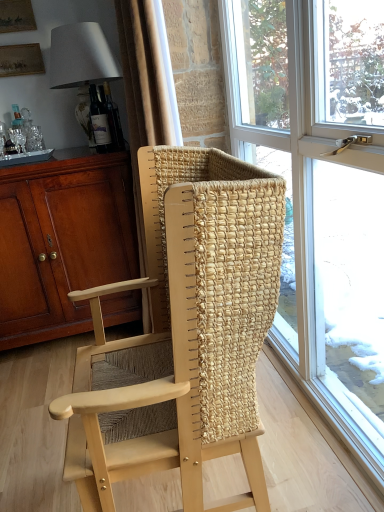
Question: From a real-world perspective, is matte gray lampshade at upper left under matte brown cabinet at left?

Choices:
 (A) yes
 (B) no

Answer: (B)

Question: Does matte gray lampshade at upper left have a smaller size compared to matte brown cabinet at left?

Choices:
 (A) no
 (B) yes

Answer: (B)

Question: Is matte gray lampshade at upper left further to the viewer compared to matte brown cabinet at left?

Choices:
 (A) no
 (B) yes

Answer: (B)

Question: Can you confirm if matte gray lampshade at upper left is taller than matte brown cabinet at left?

Choices:
 (A) no
 (B) yes

Answer: (A)

Question: Is the surface of matte gray lampshade at upper left in direct contact with matte brown cabinet at left?

Choices:
 (A) yes
 (B) no

Answer: (B)

Question: From a real-world perspective, relative to beige fabric curtain at upper center, is matte brown cabinet at left vertically above or below?

Choices:
 (A) above
 (B) below

Answer: (B)

Question: Considering their positions, is matte brown cabinet at left located in front of or behind beige fabric curtain at upper center?

Choices:
 (A) behind
 (B) front

Answer: (A)

Question: Is matte brown cabinet at left situated inside beige fabric curtain at upper center or outside?

Choices:
 (A) inside
 (B) outside

Answer: (B)

Question: Considering the positions of matte brown cabinet at left and beige fabric curtain at upper center in the image, is matte brown cabinet at left bigger or smaller than beige fabric curtain at upper center?

Choices:
 (A) big
 (B) small

Answer: (A)

Question: In terms of height, does matte gray lampshade at upper left look taller or shorter compared to matte brown cabinet at left?

Choices:
 (A) short
 (B) tall

Answer: (A)

Question: Is matte gray lampshade at upper left spatially inside matte brown cabinet at left, or outside of it?

Choices:
 (A) inside
 (B) outside

Answer: (B)

Question: Based on their positions, is matte gray lampshade at upper left located to the left or right of matte brown cabinet at left?

Choices:
 (A) right
 (B) left

Answer: (A)

Question: From the image's perspective, relative to matte brown cabinet at left, is matte gray lampshade at upper left above or below?

Choices:
 (A) above
 (B) below

Answer: (A)

Question: Is natural woven wood chair at center to the left or to the right of matte brown cabinet at left in the image?

Choices:
 (A) left
 (B) right

Answer: (B)

Question: Looking at the image, does natural woven wood chair at center seem bigger or smaller compared to matte brown cabinet at left?

Choices:
 (A) small
 (B) big

Answer: (A)